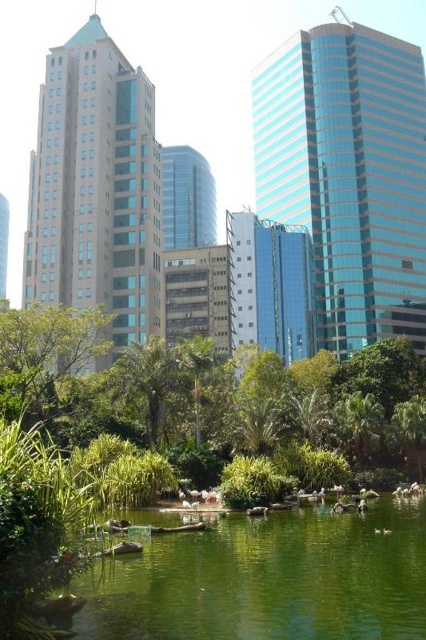
Is point (68, 308) farther from viewer compared to point (227, 518)?

Yes, point (68, 308) is farther from viewer.

You are a GUI agent. You are given a task and a screenshot of the screen. Output one action in this format:
    pyautogui.click(x=<x>, y=<y>)
    Task: Click on the green leafy tree at lower center
    The width and height of the screenshot is (426, 640).
    Given the screenshot: What is the action you would take?
    pyautogui.click(x=212, y=394)

Is blue glassy tower at upper right smaller than blue glass building at center?

No, blue glassy tower at upper right is not smaller than blue glass building at center.

Which is behind, point (394, 259) or point (255, 216)?

Point (394, 259)

Who is more distant from viewer, (x=383, y=148) or (x=282, y=346)?

Point (x=383, y=148)

Locate an element on the screen. blue glassy tower at upper right is located at coordinates (348, 173).

Who is taller, beige glass tower at left or shiny glass tower at center?

Standing taller between the two is beige glass tower at left.

Is beige glass tower at left below shiny glass tower at center?

Yes, beige glass tower at left is below shiny glass tower at center.

Does point (43, 106) come behind point (187, 224)?

No, (43, 106) is closer to viewer.

Where is `beige glass tower at left`? The height and width of the screenshot is (640, 426). beige glass tower at left is located at coordinates 95,188.